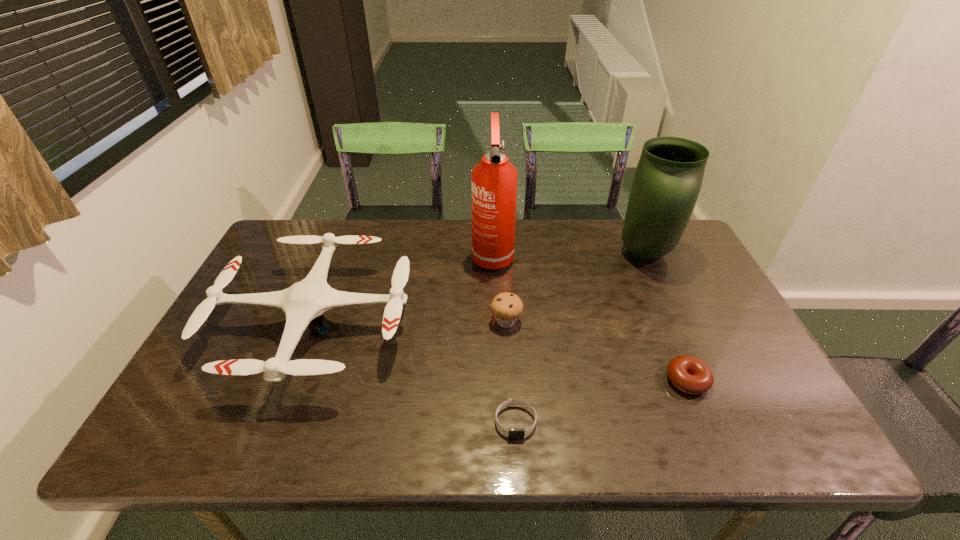
In the image, there is a desktop. At what (x,y) coordinates should I click in order to perform the action: click on vacant space at the near edge. Please return your answer as a coordinate pair (x, y). Looking at the image, I should click on (634, 433).

In the image, there is a desktop. Identify the location of vacant space at the right edge. 710,361.

At what (x,y) coordinates should I click in order to perform the action: click on blank space at the far right corner. Please return your answer as a coordinate pair (x, y). This screenshot has height=540, width=960. Looking at the image, I should click on (675, 261).

Locate an element on the screen. This screenshot has width=960, height=540. vacant area that lies between the fifth shortest object and the drone is located at coordinates (481, 289).

Where is `empty location between the leftmost object and the fire extinguisher`? empty location between the leftmost object and the fire extinguisher is located at coordinates (404, 290).

Locate an element on the screen. free spot between the fifth shortest object and the muffin is located at coordinates (576, 287).

The image size is (960, 540). I want to click on vacant point located between the tallest object and the vase, so click(568, 254).

At what (x,y) coordinates should I click in order to perform the action: click on vacant point located between the tallest object and the vase. Please return your answer as a coordinate pair (x, y). Looking at the image, I should click on (568, 254).

In order to click on free space that is in between the third shortest object and the doughnut in this screenshot , I will do point(596,350).

Locate an element on the screen. Image resolution: width=960 pixels, height=540 pixels. free point between the wristband and the vase is located at coordinates (580, 338).